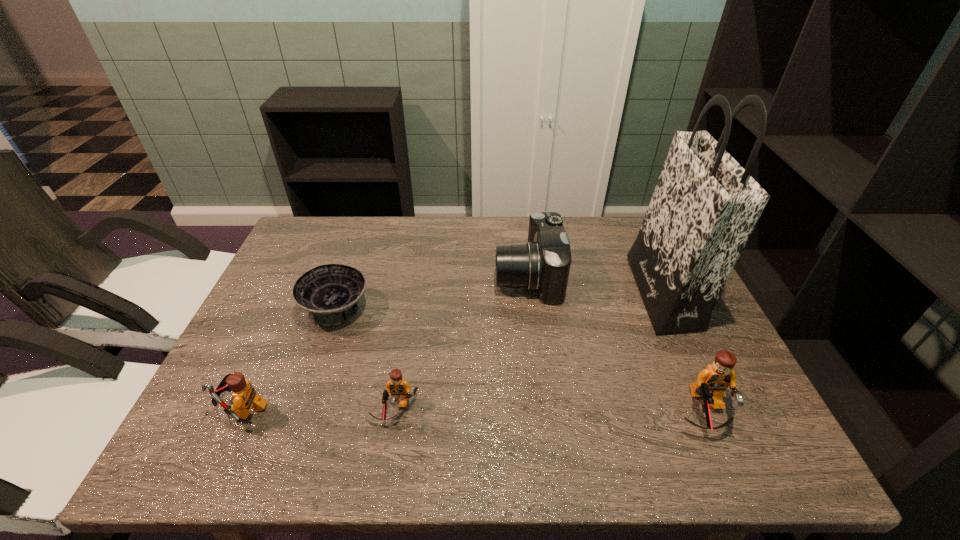
Image resolution: width=960 pixels, height=540 pixels. What are the coordinates of `the second closest Lego to the third object from right to left` in the screenshot? It's located at (399, 388).

Identify which Lego is the third closest to the bowl. Please provide its 2D coordinates. Your answer should be formatted as a tuple, i.e. [(x, y)], where the tuple contains the x and y coordinates of a point satisfying the conditions above.

[(712, 382)]